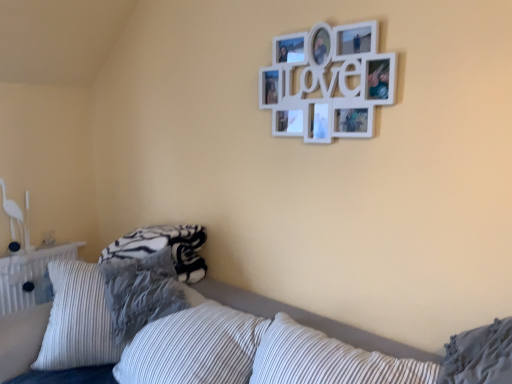
Question: Considering the relative sizes of white striped pillow at lower right, marked as the second pillow in a left-to-right arrangement, and white matte picture frame at upper center in the image provided, is white striped pillow at lower right, marked as the second pillow in a left-to-right arrangement, wider than white matte picture frame at upper center?

Choices:
 (A) no
 (B) yes

Answer: (B)

Question: Is white striped pillow at lower right, the second pillow in the back-to-front sequence, at the right side of white matte picture frame at upper center?

Choices:
 (A) no
 (B) yes

Answer: (B)

Question: From the image's perspective, would you say white striped pillow at lower right, arranged as the first pillow when viewed from the right, is shown under white matte picture frame at upper center?

Choices:
 (A) no
 (B) yes

Answer: (B)

Question: Considering the relative positions of white striped pillow at lower right, arranged as the first pillow when viewed from the right, and white matte picture frame at upper center in the image provided, is white striped pillow at lower right, arranged as the first pillow when viewed from the right, behind white matte picture frame at upper center?

Choices:
 (A) no
 (B) yes

Answer: (A)

Question: From a real-world perspective, is white striped pillow at lower right, arranged as the first pillow when viewed from the right, physically below white matte picture frame at upper center?

Choices:
 (A) no
 (B) yes

Answer: (B)

Question: Does white striped pillow at lower right, marked as the second pillow in a left-to-right arrangement, have a larger size compared to white matte picture frame at upper center?

Choices:
 (A) yes
 (B) no

Answer: (A)

Question: Is white striped pillow at lower right, marked as the second pillow in a left-to-right arrangement, bigger than white striped pillow at lower center?

Choices:
 (A) no
 (B) yes

Answer: (A)

Question: From a real-world perspective, is white striped pillow at lower right, marked as the second pillow in a left-to-right arrangement, physically below white striped pillow at lower center?

Choices:
 (A) yes
 (B) no

Answer: (B)

Question: Does white striped pillow at lower right, acting as the first pillow starting from the front, appear on the left side of white striped pillow at lower center?

Choices:
 (A) no
 (B) yes

Answer: (A)

Question: From the image's perspective, is white striped pillow at lower right, the second pillow in the back-to-front sequence, on white striped pillow at lower center?

Choices:
 (A) yes
 (B) no

Answer: (A)

Question: Is white striped pillow at lower right, arranged as the first pillow when viewed from the right, next to white striped pillow at lower center and touching it?

Choices:
 (A) yes
 (B) no

Answer: (B)

Question: Is white striped pillow at lower right, the second pillow in the back-to-front sequence, positioned before white striped pillow at lower center?

Choices:
 (A) yes
 (B) no

Answer: (B)

Question: From a real-world perspective, is textured gray pillow at lower left, which is counted as the 2th pillow, starting from the front, below white striped pillow at lower right, marked as the second pillow in a left-to-right arrangement?

Choices:
 (A) no
 (B) yes

Answer: (B)